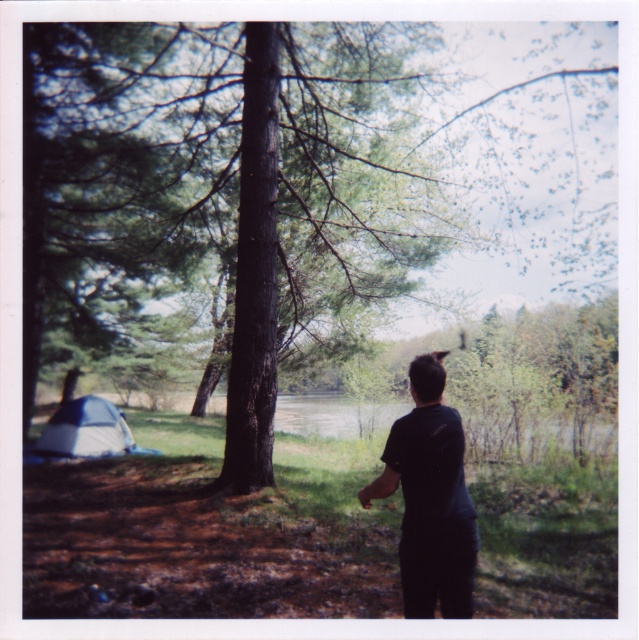
Can you confirm if green rough bark tree at center is taller than black matte shirt at center?

Yes, green rough bark tree at center is taller than black matte shirt at center.

Does green rough bark tree at center appear on the left side of black matte shirt at center?

Yes, green rough bark tree at center is to the left of black matte shirt at center.

Does point (296, 276) come farther from viewer compared to point (463, 563)?

That is True.

This screenshot has width=639, height=640. In order to click on green rough bark tree at center in this screenshot , I will do `click(279, 189)`.

Is black matte shirt at center smaller than gray fabric tent at lower left?

Yes.

Does black matte shirt at center have a lesser width compared to gray fabric tent at lower left?

Correct, black matte shirt at center's width is less than gray fabric tent at lower left's.

Between point (436, 536) and point (116, 435), which one is positioned in front?

Point (436, 536)

Identify the location of black matte shirt at center. (429, 497).

Who is shorter, green rough bark tree at center or gray fabric tent at lower left?

Standing shorter between the two is gray fabric tent at lower left.

Is point (42, 321) less distant than point (88, 401)?

No, it is behind (88, 401).

Measure the distance between green rough bark tree at center and camera.

green rough bark tree at center is 8.46 meters from camera.

Identify the location of green rough bark tree at center. (279, 189).